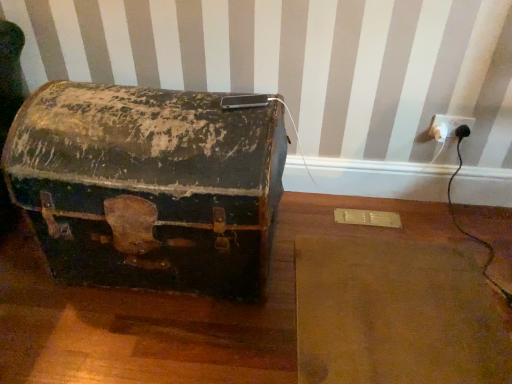
Question: Is white plastic outlet at right situated inside rusty metal trunk at center or outside?

Choices:
 (A) outside
 (B) inside

Answer: (A)

Question: Considering the positions of white plastic outlet at right and rusty metal trunk at center in the image, is white plastic outlet at right wider or thinner than rusty metal trunk at center?

Choices:
 (A) thin
 (B) wide

Answer: (A)

Question: Does point (459, 122) appear closer or farther from the camera than point (61, 178)?

Choices:
 (A) farther
 (B) closer

Answer: (A)

Question: Considering the positions of rusty metal trunk at center and white plastic outlet at right in the image, is rusty metal trunk at center taller or shorter than white plastic outlet at right?

Choices:
 (A) tall
 (B) short

Answer: (A)

Question: Based on their sizes in the image, would you say rusty metal trunk at center is bigger or smaller than white plastic outlet at right?

Choices:
 (A) big
 (B) small

Answer: (A)

Question: Considering the positions of rusty metal trunk at center and white plastic outlet at right in the image, is rusty metal trunk at center wider or thinner than white plastic outlet at right?

Choices:
 (A) thin
 (B) wide

Answer: (B)

Question: Visually, is rusty metal trunk at center positioned to the left or to the right of white plastic outlet at right?

Choices:
 (A) right
 (B) left

Answer: (B)